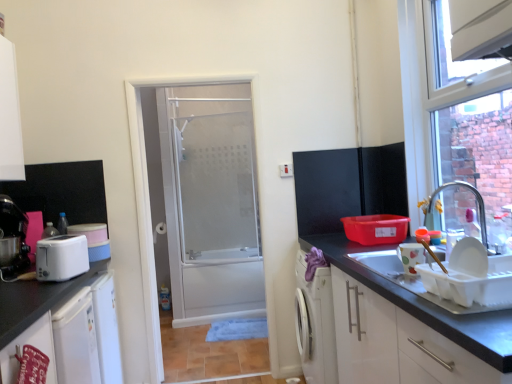
Find the location of a particular element. free space to the back side of matte ceramic cup at right, acting as the 1th appliance starting from the front is located at coordinates (385, 261).